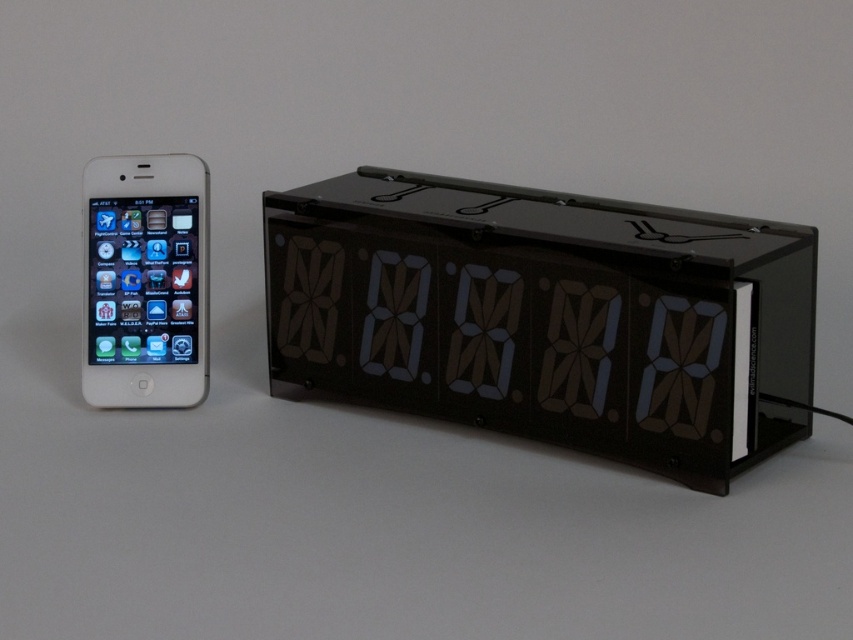
Question: In this image, where is black plastic digital clock at center located relative to white glossy ipod at left?

Choices:
 (A) above
 (B) below

Answer: (B)

Question: Which point is closer to the camera?

Choices:
 (A) (93, 317)
 (B) (375, 364)

Answer: (A)

Question: Does black plastic digital clock at center appear under white glossy ipod at left?

Choices:
 (A) yes
 (B) no

Answer: (A)

Question: Where is black plastic digital clock at center located in relation to white glossy ipod at left in the image?

Choices:
 (A) above
 (B) below

Answer: (B)